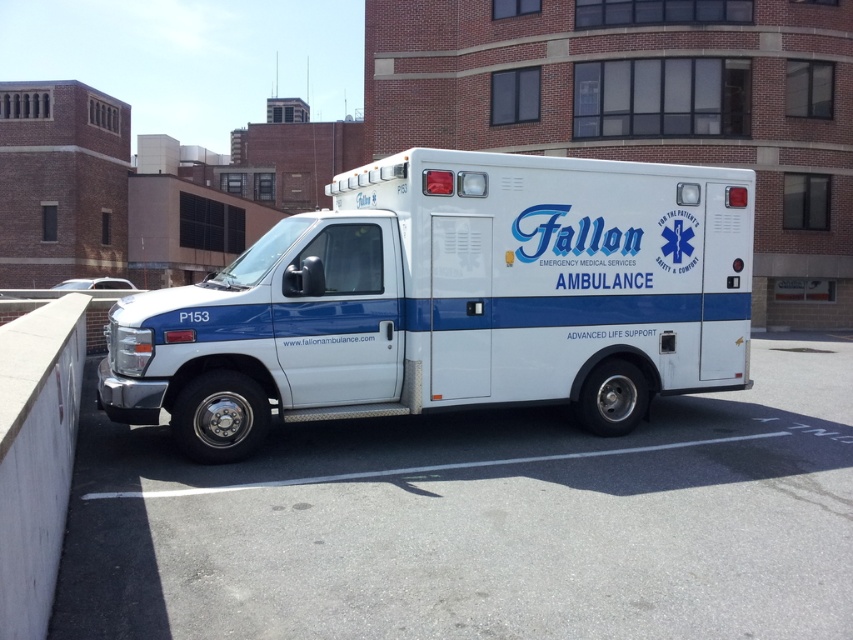
Question: Is the position of white smooth asphalt at center less distant than that of white glossy ambulance at center?

Choices:
 (A) yes
 (B) no

Answer: (A)

Question: Which object is farther from the camera taking this photo?

Choices:
 (A) white smooth asphalt at center
 (B) white glossy ambulance at center

Answer: (B)

Question: Does white smooth asphalt at center have a smaller size compared to white glossy ambulance at center?

Choices:
 (A) yes
 (B) no

Answer: (A)

Question: Among these objects, which one is nearest to the camera?

Choices:
 (A) white glossy ambulance at center
 (B) white smooth asphalt at center

Answer: (B)

Question: Is white smooth asphalt at center wider than white glossy ambulance at center?

Choices:
 (A) yes
 (B) no

Answer: (B)